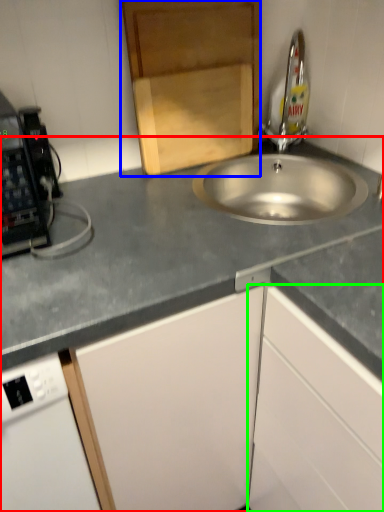
Question: Based on their relative distances, which object is farther from countertop (highlighted by a red box)? Choose from cabinetry (highlighted by a blue box) and cabinetry (highlighted by a green box).

Choices:
 (A) cabinetry
 (B) cabinetry

Answer: (A)